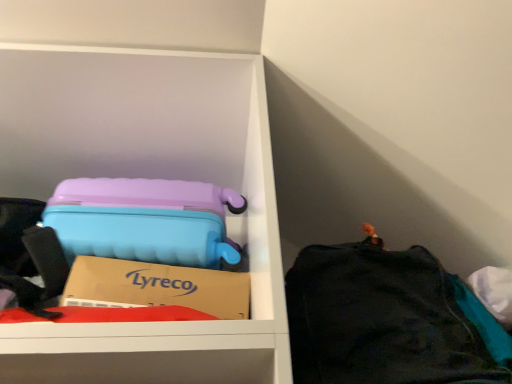
The width and height of the screenshot is (512, 384). What are the coordinates of `black fabric bag at right` in the screenshot? It's located at (388, 319).

The width and height of the screenshot is (512, 384). Describe the element at coordinates (388, 319) in the screenshot. I see `black fabric bag at right` at that location.

In order to face black fabric bag at right, should I rotate leftwards or rightwards?

To align with it, rotate right about 19.913°.

Locate an element on the screen. The image size is (512, 384). matte plastic suitcase at upper left is located at coordinates (153, 177).

Image resolution: width=512 pixels, height=384 pixels. Describe the element at coordinates (153, 177) in the screenshot. I see `matte plastic suitcase at upper left` at that location.

The width and height of the screenshot is (512, 384). Find the location of `black fabric bag at right`. black fabric bag at right is located at coordinates (388, 319).

Which is more to the right, black fabric bag at right or matte plastic suitcase at upper left?

Positioned to the right is black fabric bag at right.

Which is behind, black fabric bag at right or matte plastic suitcase at upper left?

matte plastic suitcase at upper left is behind.

Is point (421, 303) behind point (234, 220)?

No, it is not.

From the image's perspective, is black fabric bag at right below matte plastic suitcase at upper left?

Indeed, from the image's perspective, black fabric bag at right is shown beneath matte plastic suitcase at upper left.

From a real-world perspective, who is located lower, black fabric bag at right or matte plastic suitcase at upper left?

In real-world perspective, black fabric bag at right is lower.

Is black fabric bag at right wider than matte plastic suitcase at upper left?

Indeed, black fabric bag at right has a greater width compared to matte plastic suitcase at upper left.

Considering the sizes of objects black fabric bag at right and matte plastic suitcase at upper left in the image provided, who is shorter, black fabric bag at right or matte plastic suitcase at upper left?

black fabric bag at right is shorter.

Considering the relative sizes of black fabric bag at right and matte plastic suitcase at upper left in the image provided, is black fabric bag at right bigger than matte plastic suitcase at upper left?

Actually, black fabric bag at right might be smaller than matte plastic suitcase at upper left.

Do you think black fabric bag at right is within matte plastic suitcase at upper left, or outside of it?

The correct answer is: outside.

Does black fabric bag at right touch matte plastic suitcase at upper left?

No, black fabric bag at right is not touching matte plastic suitcase at upper left.

Is matte plastic suitcase at upper left at the back of black fabric bag at right?

No, black fabric bag at right is not facing away from matte plastic suitcase at upper left.

How different are the orientations of black fabric bag at right and matte plastic suitcase at upper left in degrees?

There is a 0.00189-degree angle between the facing directions of black fabric bag at right and matte plastic suitcase at upper left.

Identify the location of luggage and bags on the right of the matte plastic suitcase at upper left. (388, 319).

In the image, is matte plastic suitcase at upper left on the left side or the right side of black fabric bag at right?

Based on their positions, matte plastic suitcase at upper left is located to the left of black fabric bag at right.

Is matte plastic suitcase at upper left in front of or behind black fabric bag at right in the image?

Visually, matte plastic suitcase at upper left is located behind black fabric bag at right.

Which point is more forward, (264,300) or (430,260)?

Positioned in front is point (430,260).

From the image's perspective, would you say matte plastic suitcase at upper left is positioned over black fabric bag at right?

Indeed, from the image's perspective, matte plastic suitcase at upper left is shown above black fabric bag at right.

From a real-world perspective, is matte plastic suitcase at upper left located higher than black fabric bag at right?

Yes, from a real-world perspective, matte plastic suitcase at upper left is on top of black fabric bag at right.

Which of these two, matte plastic suitcase at upper left or black fabric bag at right, is wider?

black fabric bag at right.

Who is shorter, matte plastic suitcase at upper left or black fabric bag at right?

black fabric bag at right.

Does matte plastic suitcase at upper left have a smaller size compared to black fabric bag at right?

Incorrect, matte plastic suitcase at upper left is not smaller in size than black fabric bag at right.

Could black fabric bag at right be considered to be inside matte plastic suitcase at upper left?

That's incorrect, black fabric bag at right is not inside matte plastic suitcase at upper left.

Looking at this image, is matte plastic suitcase at upper left positioned far away from black fabric bag at right?

They are positioned close to each other.

Is matte plastic suitcase at upper left positioned with its back to black fabric bag at right?

No, matte plastic suitcase at upper left is not facing away from black fabric bag at right.

What's the angular difference between matte plastic suitcase at upper left and black fabric bag at right's facing directions?

There is a 0.00189-degree angle between the facing directions of matte plastic suitcase at upper left and black fabric bag at right.

This screenshot has height=384, width=512. I want to click on luggage and bags below the matte plastic suitcase at upper left (from the image's perspective), so click(x=388, y=319).

The height and width of the screenshot is (384, 512). There is a black fabric bag at right. In order to click on furniture above it (from a real-world perspective) in this screenshot , I will do `click(153, 177)`.

At what (x,y) coordinates should I click in order to perform the action: click on furniture that is on the left side of black fabric bag at right. Please return your answer as a coordinate pair (x, y). The width and height of the screenshot is (512, 384). Looking at the image, I should click on (153, 177).